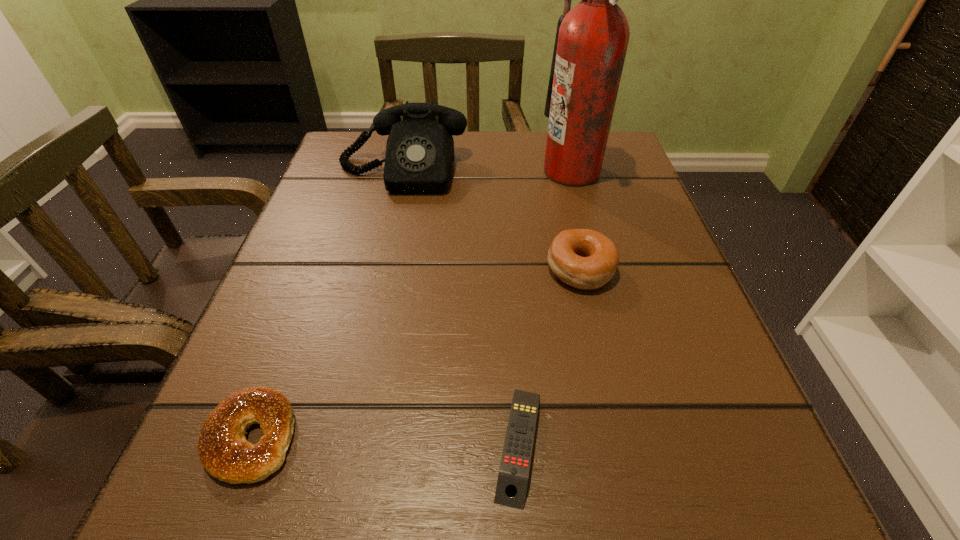
Locate an element on the screen. The image size is (960, 540). free space located 0.110m on the front of the fire extinguisher near the operation label is located at coordinates (492, 171).

Where is `free space located on the dial of the telephone`? The image size is (960, 540). free space located on the dial of the telephone is located at coordinates (383, 253).

Identify the location of blank space located 0.120m on the left of the third nearest object. The height and width of the screenshot is (540, 960). (473, 269).

Locate an element on the screen. The width and height of the screenshot is (960, 540). blank area located on the right of the left bagel is located at coordinates (412, 437).

Where is `vacant space situated 0.140m on the right of the shortest object`? vacant space situated 0.140m on the right of the shortest object is located at coordinates (664, 444).

This screenshot has height=540, width=960. What are the coordinates of `fire extinguisher that is at the far edge` in the screenshot? It's located at tap(591, 41).

I want to click on telephone that is at the far edge, so click(x=419, y=158).

Find the location of a particular element. The image size is (960, 540). bagel that is at the near edge is located at coordinates (223, 450).

In order to click on remote control that is at the near edge in this screenshot , I will do `click(512, 482)`.

What are the coordinates of `telephone positioned at the left edge` in the screenshot? It's located at (419, 158).